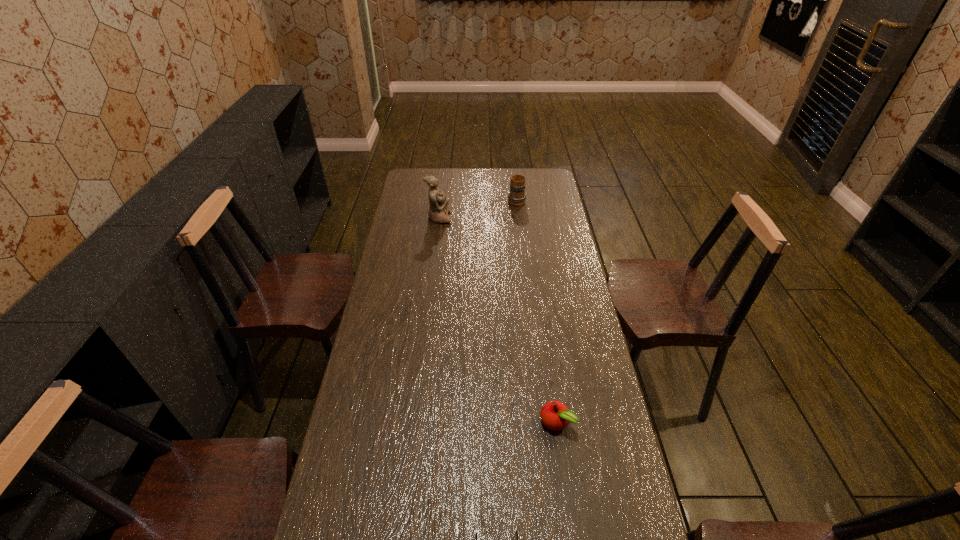
At what (x,y) coordinates should I click in order to perform the action: click on the tallest object. Please return your answer as a coordinate pair (x, y). Looking at the image, I should click on (438, 203).

Locate an element on the screen. This screenshot has height=540, width=960. figurine is located at coordinates (438, 203).

The width and height of the screenshot is (960, 540). In order to click on the farthest object in this screenshot , I will do `click(516, 197)`.

The height and width of the screenshot is (540, 960). Find the location of `mug`. mug is located at coordinates (516, 197).

Where is `apple`? This screenshot has width=960, height=540. apple is located at coordinates (555, 415).

Where is `the third farthest object`? This screenshot has width=960, height=540. the third farthest object is located at coordinates (555, 415).

You are a GUI agent. You are given a task and a screenshot of the screen. Output one action in this format:
    pyautogui.click(x=<x>, y=<y>)
    Task: Click on the blank space located 0.280m on the front-facing side of the figurine
    
    Given the screenshot: What is the action you would take?
    pyautogui.click(x=512, y=218)

Identify the location of vacant region located 0.220m on the side of the mug with the handle. This screenshot has height=540, width=960. (514, 172).

Locate an element on the screen. free space located 0.150m on the side of the mug with the handle is located at coordinates point(514,178).

Locate an element on the screen. The image size is (960, 540). vacant space located 0.120m on the side of the mug with the handle is located at coordinates (515, 181).